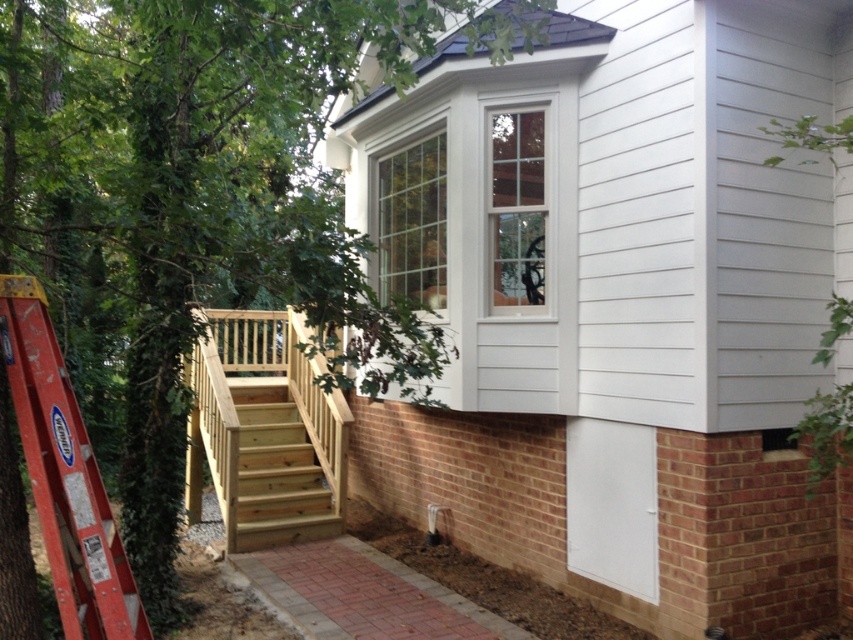
Question: Considering the relative positions of natural wood stairs at lower left and red metal ladder at left in the image provided, where is natural wood stairs at lower left located with respect to red metal ladder at left?

Choices:
 (A) right
 (B) left

Answer: (B)

Question: Based on their relative distances, which object is nearer to the natural wood stairs at lower left?

Choices:
 (A) red metal ladder at left
 (B) white glass window at upper center
 (C) clear glass window at upper center
 (D) light brown wooden stairs at center

Answer: (D)

Question: Among these points, which one is farthest from the camera?

Choices:
 (A) (257, 449)
 (B) (281, 433)
 (C) (45, 406)
 (D) (439, 180)

Answer: (B)

Question: Estimate the real-world distances between objects in this image. Which object is closer to the light brown wooden stairs at center?

Choices:
 (A) white glass window at upper center
 (B) clear glass window at upper center

Answer: (B)

Question: Is the position of red metal ladder at left more distant than that of light brown wooden stairs at center?

Choices:
 (A) yes
 (B) no

Answer: (B)

Question: Is natural wood stairs at lower left to the right of light brown wooden stairs at center from the viewer's perspective?

Choices:
 (A) no
 (B) yes

Answer: (A)